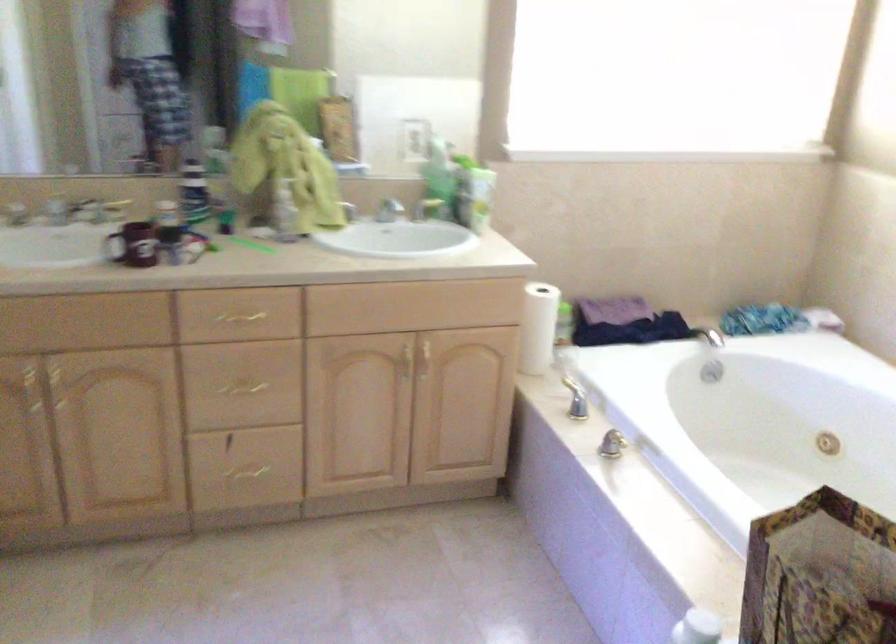
Where would you lift the red mug handle? Please return your answer as a coordinate pair (x, y).

(113, 243)